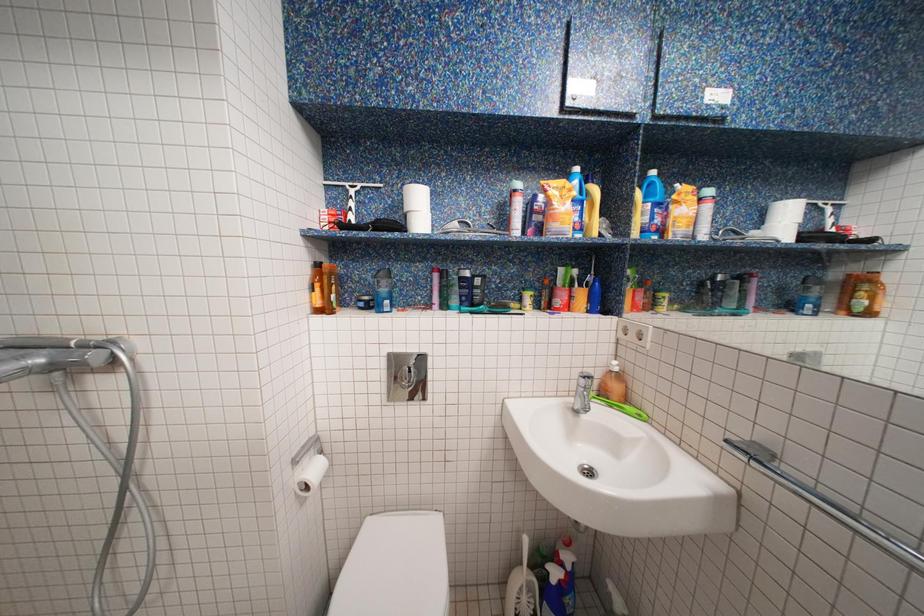
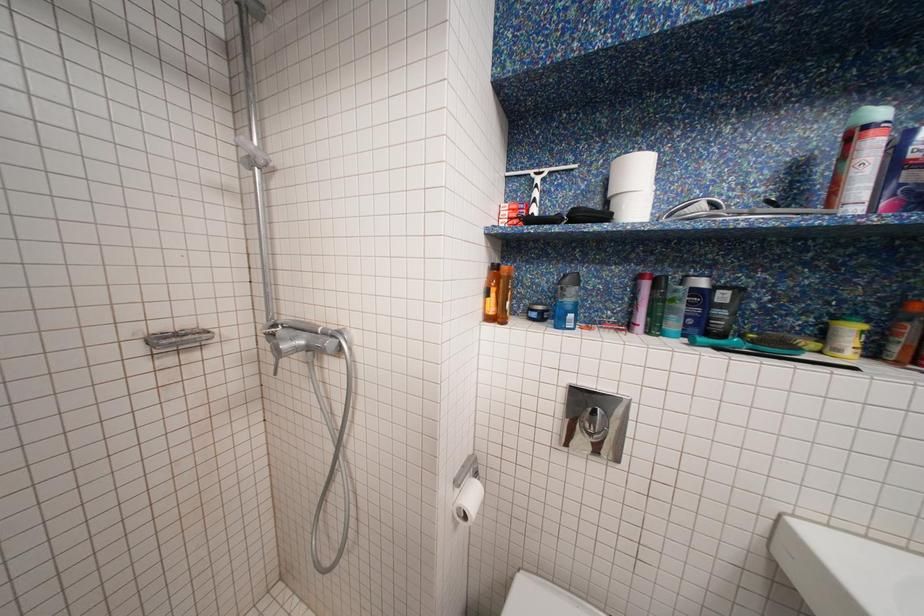
Question: Based on the continuous images, in which direction is the camera rotating? Reply with the corresponding letter.

Choices:
 (A) Left
 (B) Right
 (C) Up
 (D) Down

Answer: (A)